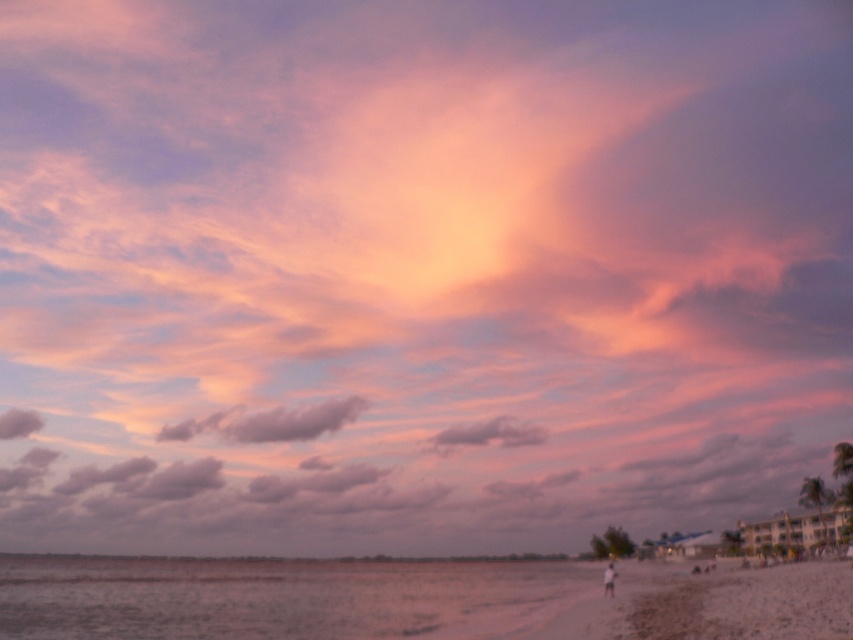
Question: Observing the image, what is the correct spatial positioning of sandy water at lower left in reference to blurred white figure at lower right?

Choices:
 (A) right
 (B) left

Answer: (B)

Question: Among these points, which one is nearest to the camera?

Choices:
 (A) (206, 428)
 (B) (606, 576)
 (C) (515, 436)

Answer: (B)

Question: Which object appears closest to the camera in this image?

Choices:
 (A) sandy water at lower left
 (B) pink fluffy cloud at center
 (C) purple cotton cloud at center
 (D) blurred white figure at lower right

Answer: (A)

Question: Is sandy water at lower left to the left of blurred white figure at lower right from the viewer's perspective?

Choices:
 (A) no
 (B) yes

Answer: (B)

Question: Can you confirm if white sandy beach at lower right is positioned below purple cotton cloud at center?

Choices:
 (A) yes
 (B) no

Answer: (B)

Question: Estimate the real-world distances between objects in this image. Which object is closer to the gray cotton cloud at upper left?

Choices:
 (A) white sandy beach at lower right
 (B) pink fluffy cloud at center
 (C) sandy water at lower left

Answer: (C)